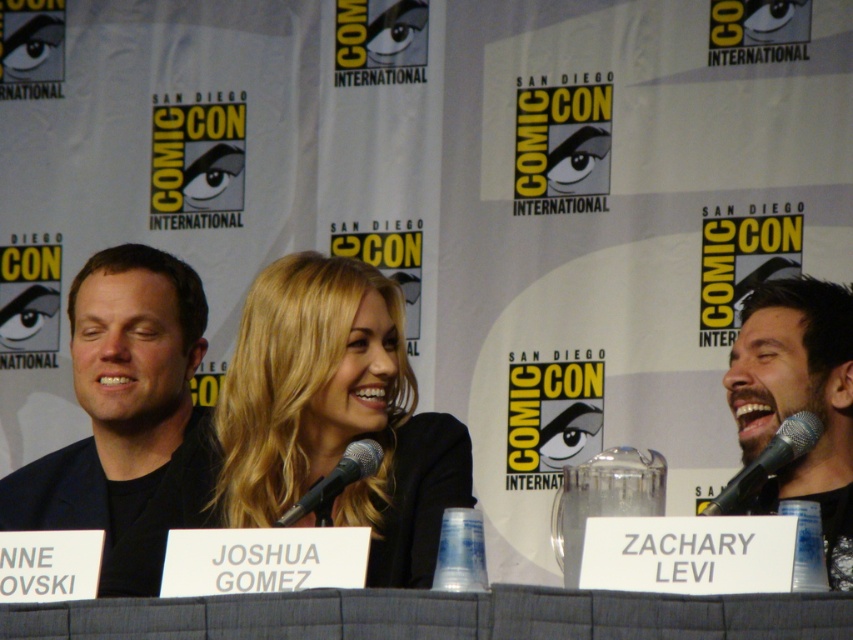
Question: Is black matte suit at left below silver metallic microphone at right?

Choices:
 (A) yes
 (B) no

Answer: (A)

Question: Which point is closer to the camera?

Choices:
 (A) black metallic microphone at center
 (B) blonde hair at center

Answer: (A)

Question: Does black matte suit at left have a larger size compared to silver metallic microphone at right?

Choices:
 (A) yes
 (B) no

Answer: (A)

Question: Based on their relative distances, which object is nearer to the black matte suit at left?

Choices:
 (A) blonde hair at center
 (B) silver metallic microphone at right
 (C) black metallic microphone at center
 (D) gray fabric table at center

Answer: (A)

Question: Is gray fabric table at center positioned before black metallic microphone at center?

Choices:
 (A) no
 (B) yes

Answer: (B)

Question: Which point appears farthest from the camera in this image?

Choices:
 (A) (132, 496)
 (B) (396, 432)
 (C) (334, 627)

Answer: (A)